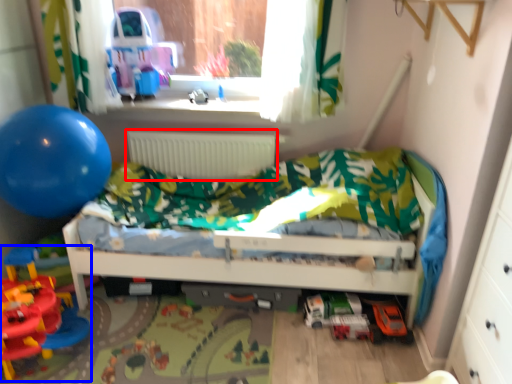
Question: Which of the following is the farthest to the observer, radiator (highlighted by a red box) or toy (highlighted by a blue box)?

Choices:
 (A) radiator
 (B) toy

Answer: (A)